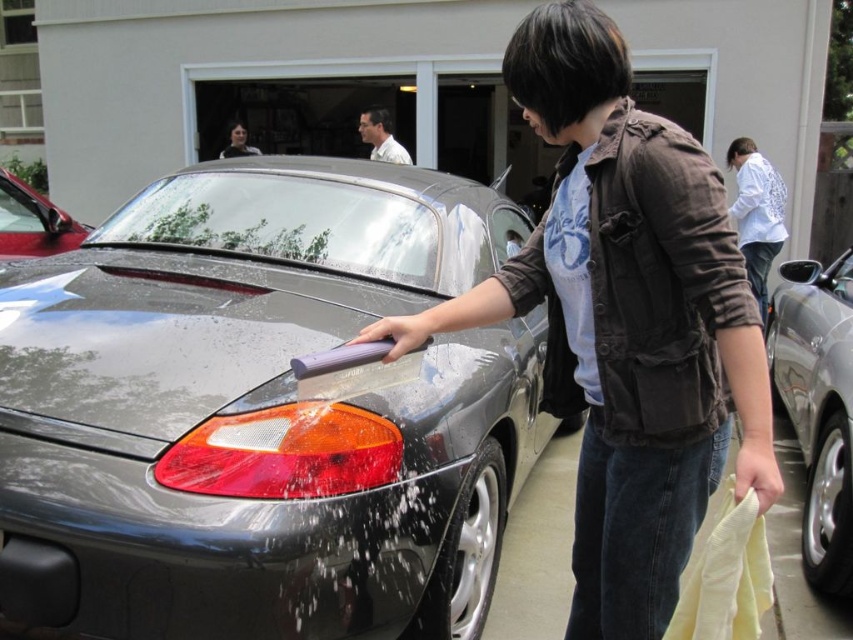
Question: From the image, what is the correct spatial relationship of matte black jacket at center in relation to glossy metallic car at upper left?

Choices:
 (A) right
 (B) left

Answer: (A)

Question: Which object is farther from the camera taking this photo?

Choices:
 (A) white textured shirt at upper right
 (B) glossy metallic car at upper left

Answer: (A)

Question: Which point is farther to the camera?

Choices:
 (A) (86, 234)
 (B) (375, 138)
 (C) (242, 132)

Answer: (C)

Question: Can you confirm if satin silver car at right is thinner than glossy metallic car at upper left?

Choices:
 (A) yes
 (B) no

Answer: (B)

Question: Which object appears farthest from the camera in this image?

Choices:
 (A) smooth skin face at upper center
 (B) glossy metallic car at upper left

Answer: (A)

Question: Does satin silver car at right appear under white textured shirt at upper right?

Choices:
 (A) yes
 (B) no

Answer: (A)